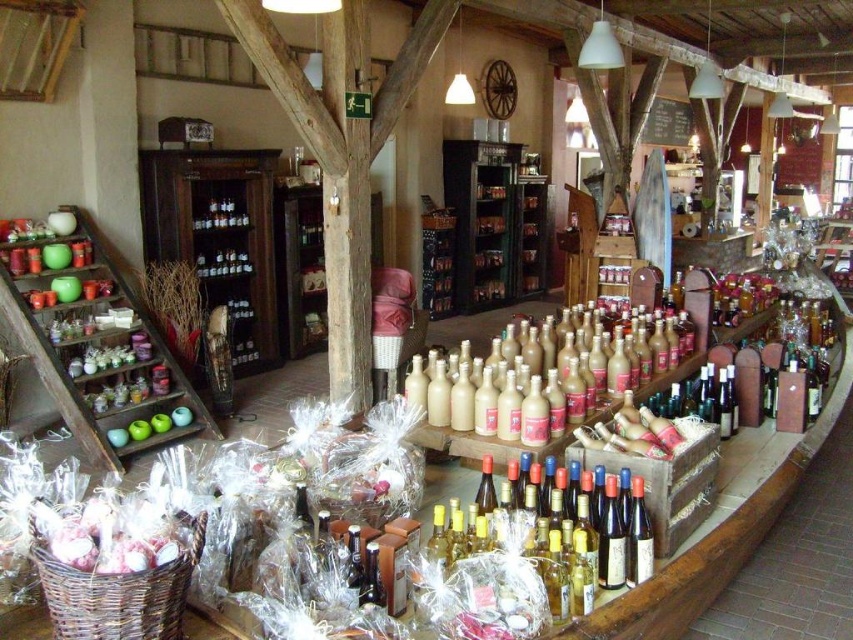
Does wooden cabinet at center appear on the left side of white paper wrapped at lower left?

Indeed, wooden cabinet at center is positioned on the left side of white paper wrapped at lower left.

Is point (157, 228) farther from viewer compared to point (148, 522)?

Yes, it is behind point (148, 522).

I want to click on wooden cabinet at center, so click(x=218, y=237).

Who is shorter, wooden shelves at left or matte brown glass bottles at center?

Standing shorter between the two is matte brown glass bottles at center.

Who is positioned more to the left, wooden shelves at left or matte brown glass bottles at center?

wooden shelves at left

The height and width of the screenshot is (640, 853). I want to click on wooden shelves at left, so click(x=97, y=349).

The image size is (853, 640). In order to click on wooden shelves at left in this screenshot , I will do `click(97, 349)`.

What do you see at coordinates (218, 237) in the screenshot? I see `wooden cabinet at center` at bounding box center [218, 237].

In the scene shown: Who is more forward, (207, 257) or (206, 218)?

Point (206, 218) is in front.

Who is more distant from viewer, [236,260] or [207,220]?

The point [236,260] is behind.

Image resolution: width=853 pixels, height=640 pixels. I want to click on wooden cabinet at center, so click(x=218, y=237).